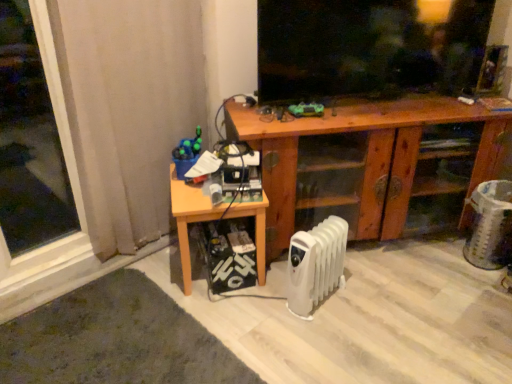
Question: From a real-world perspective, is wooden cabinet at center on top of white plastic radiator at lower center?

Choices:
 (A) no
 (B) yes

Answer: (B)

Question: Is wooden cabinet at center at the left side of white plastic radiator at lower center?

Choices:
 (A) no
 (B) yes

Answer: (A)

Question: Can you confirm if wooden cabinet at center is shorter than white plastic radiator at lower center?

Choices:
 (A) yes
 (B) no

Answer: (B)

Question: Could you tell me if wooden cabinet at center is turned towards white plastic radiator at lower center?

Choices:
 (A) yes
 (B) no

Answer: (A)

Question: Is wooden cabinet at center in front of white plastic radiator at lower center?

Choices:
 (A) yes
 (B) no

Answer: (B)

Question: From the image's perspective, is beige fabric curtain at left located above or below wooden table at lower left?

Choices:
 (A) below
 (B) above

Answer: (B)

Question: Considering the positions of beige fabric curtain at left and wooden table at lower left in the image, is beige fabric curtain at left taller or shorter than wooden table at lower left?

Choices:
 (A) tall
 (B) short

Answer: (A)

Question: Is beige fabric curtain at left to the left or to the right of wooden table at lower left in the image?

Choices:
 (A) right
 (B) left

Answer: (B)

Question: Is point (66, 84) closer or farther from the camera than point (193, 192)?

Choices:
 (A) closer
 (B) farther

Answer: (A)

Question: Considering the positions of point (308, 233) and point (207, 210), is point (308, 233) closer or farther from the camera than point (207, 210)?

Choices:
 (A) farther
 (B) closer

Answer: (B)

Question: Is white plastic radiator at lower center inside or outside of wooden table at lower left?

Choices:
 (A) inside
 (B) outside

Answer: (B)

Question: Is white plastic radiator at lower center bigger or smaller than wooden table at lower left?

Choices:
 (A) big
 (B) small

Answer: (B)

Question: From a real-world perspective, is white plastic radiator at lower center positioned above or below wooden table at lower left?

Choices:
 (A) above
 (B) below

Answer: (B)

Question: Looking at their shapes, would you say white plastic radiator at lower center is wider or thinner than transparent glass window at left?

Choices:
 (A) wide
 (B) thin

Answer: (B)

Question: Is white plastic radiator at lower center to the left or to the right of transparent glass window at left in the image?

Choices:
 (A) left
 (B) right

Answer: (B)